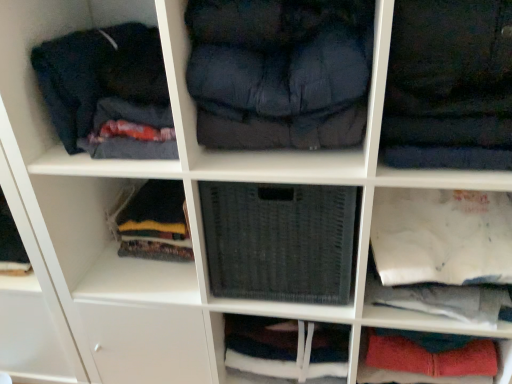
Question: Is the surface of dark blue fabric at upper right, the 1th clothing from the right, in direct contact with woven fabric basket at center, which is the second cabinet from left to right?

Choices:
 (A) no
 (B) yes

Answer: (A)

Question: Is dark blue fabric at upper right, placed as the 2th clothing when sorted from left to right, looking in the opposite direction of woven fabric basket at center, which is the second cabinet from left to right?

Choices:
 (A) no
 (B) yes

Answer: (A)

Question: From the image's perspective, is dark blue fabric at upper right, placed as the 2th clothing when sorted from left to right, above woven fabric basket at center, which is the second cabinet from left to right?

Choices:
 (A) no
 (B) yes

Answer: (B)

Question: Is woven fabric basket at center, which is the second cabinet from left to right, a part of dark blue fabric at upper right, the 1th clothing from the right?

Choices:
 (A) no
 (B) yes

Answer: (A)

Question: Considering the relative sizes of dark blue fabric at upper right, the 1th clothing from the right, and woven fabric basket at center, which is the second cabinet from left to right, in the image provided, is dark blue fabric at upper right, the 1th clothing from the right, smaller than woven fabric basket at center, which is the second cabinet from left to right,?

Choices:
 (A) no
 (B) yes

Answer: (A)

Question: Is dark blue fabric at upper right, placed as the 2th clothing when sorted from left to right, taller than woven fabric basket at center, which is the second cabinet from left to right?

Choices:
 (A) yes
 (B) no

Answer: (B)

Question: Is there a large distance between dark blue fabric at center, the first clothing in the left-to-right sequence, and woven fabric basket at center, which is the second cabinet from left to right?

Choices:
 (A) no
 (B) yes

Answer: (A)

Question: Is dark blue fabric at center, the first clothing in the left-to-right sequence, shorter than woven fabric basket at center, which ranks as the 3th cabinet in right-to-left order?

Choices:
 (A) yes
 (B) no

Answer: (B)

Question: Is dark blue fabric at center, the first clothing in the left-to-right sequence, looking in the opposite direction of woven fabric basket at center, which is the second cabinet from left to right?

Choices:
 (A) no
 (B) yes

Answer: (A)

Question: Is dark blue fabric at center, marked as the second clothing in a right-to-left arrangement, not within woven fabric basket at center, which ranks as the 3th cabinet in right-to-left order?

Choices:
 (A) no
 (B) yes

Answer: (B)

Question: Does dark blue fabric at center, the first clothing in the left-to-right sequence, contain woven fabric basket at center, which is the second cabinet from left to right?

Choices:
 (A) no
 (B) yes

Answer: (A)

Question: Are dark blue fabric at center, marked as the second clothing in a right-to-left arrangement, and woven fabric basket at center, which is the second cabinet from left to right, making contact?

Choices:
 (A) yes
 (B) no

Answer: (B)

Question: Considering the relative sizes of dark blue fabric at center, the first clothing in the left-to-right sequence, and dark blue fabric at upper right, placed as the 2th clothing when sorted from left to right, in the image provided, is dark blue fabric at center, the first clothing in the left-to-right sequence, thinner than dark blue fabric at upper right, placed as the 2th clothing when sorted from left to right,?

Choices:
 (A) no
 (B) yes

Answer: (B)